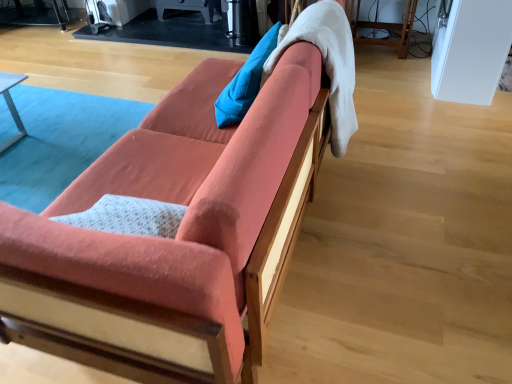
Question: From the image's perspective, is blue fabric pillow at upper center located above coral fabric couch at center?

Choices:
 (A) no
 (B) yes

Answer: (B)

Question: Can you confirm if blue fabric pillow at upper center is wider than coral fabric couch at center?

Choices:
 (A) no
 (B) yes

Answer: (A)

Question: Is blue fabric pillow at upper center outside of coral fabric couch at center?

Choices:
 (A) yes
 (B) no

Answer: (B)

Question: Is coral fabric couch at center located within blue fabric pillow at upper center?

Choices:
 (A) no
 (B) yes

Answer: (A)

Question: Is blue fabric pillow at upper center far from coral fabric couch at center?

Choices:
 (A) no
 (B) yes

Answer: (A)

Question: Does blue fabric pillow at upper center have a lesser height compared to coral fabric couch at center?

Choices:
 (A) no
 (B) yes

Answer: (B)

Question: Is white soft blanket at upper right closer to the viewer compared to blue fabric pillow at upper center?

Choices:
 (A) no
 (B) yes

Answer: (B)

Question: Does white soft blanket at upper right contain blue fabric pillow at upper center?

Choices:
 (A) no
 (B) yes

Answer: (A)

Question: Can you confirm if white soft blanket at upper right is wider than blue fabric pillow at upper center?

Choices:
 (A) no
 (B) yes

Answer: (B)

Question: Does white soft blanket at upper right have a greater height compared to blue fabric pillow at upper center?

Choices:
 (A) yes
 (B) no

Answer: (A)

Question: Considering the relative sizes of white soft blanket at upper right and blue fabric pillow at upper center in the image provided, is white soft blanket at upper right shorter than blue fabric pillow at upper center?

Choices:
 (A) no
 (B) yes

Answer: (A)

Question: From the image's perspective, does white soft blanket at upper right appear higher than blue fabric pillow at upper center?

Choices:
 (A) yes
 (B) no

Answer: (B)

Question: Does blue fabric pillow at upper center turn towards white soft blanket at upper right?

Choices:
 (A) no
 (B) yes

Answer: (A)